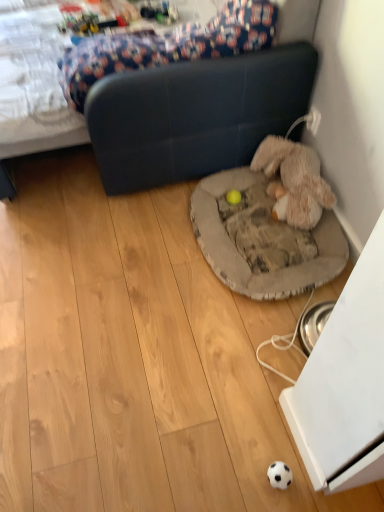
Measure the distance between point (316,200) and camera.

The depth of point (316,200) is 5.65 feet.

This screenshot has height=512, width=384. In order to click on fuzzy beige stuffed animal at lower right, which ranks as the 1th toy in right-to-left order in this screenshot , I will do `click(295, 179)`.

What is the approximate width of gray fabric dog bed at center?

gray fabric dog bed at center is 22.68 inches wide.

Where is `fuzzy beige stuffed animal at lower right, which ranks as the 1th toy in right-to-left order`? The image size is (384, 512). fuzzy beige stuffed animal at lower right, which ranks as the 1th toy in right-to-left order is located at coordinates (295, 179).

Between fuzzy beige stuffed animal at lower right, which ranks as the 1th toy in right-to-left order, and floral fabric mattress at upper left, which one appears on the left side from the viewer's perspective?

From the viewer's perspective, floral fabric mattress at upper left appears more on the left side.

Where is `toy that is the 1st object located below the floral fabric mattress at upper left (from the image's perspective)`? The height and width of the screenshot is (512, 384). toy that is the 1st object located below the floral fabric mattress at upper left (from the image's perspective) is located at coordinates (295, 179).

Does point (296, 222) come behind point (78, 73)?

Yes, point (296, 222) is behind point (78, 73).

Is fuzzy beige stuffed animal at lower right, the 2th toy from the left, positioned behind floral fabric mattress at upper left?

Yes, fuzzy beige stuffed animal at lower right, the 2th toy from the left, is behind floral fabric mattress at upper left.

Looking at this image, how many degrees apart are the facing directions of fuzzy beige stuffed animal at lower right, the 2th toy from the left, and gray fabric dog bed at center?

The facing directions of fuzzy beige stuffed animal at lower right, the 2th toy from the left, and gray fabric dog bed at center are 2.88e-05 degrees apart.

Does fuzzy beige stuffed animal at lower right, which ranks as the 1th toy in right-to-left order, appear on the left side of gray fabric dog bed at center?

No, fuzzy beige stuffed animal at lower right, which ranks as the 1th toy in right-to-left order, is not to the left of gray fabric dog bed at center.

This screenshot has height=512, width=384. I want to click on the 2nd toy positioned above the gray fabric dog bed at center (from the image's perspective), so click(x=295, y=179).

Considering the positions of objects gray fabric dog bed at center and dark blue leather studio couch at center in the image provided, who is more to the right, gray fabric dog bed at center or dark blue leather studio couch at center?

gray fabric dog bed at center.

In the image, there is a dark blue leather studio couch at center. What are the coordinates of `dog bed below it (from a real-world perspective)` in the screenshot? It's located at (262, 240).

In terms of height, does gray fabric dog bed at center look taller or shorter compared to dark blue leather studio couch at center?

Considering their sizes, gray fabric dog bed at center has less height than dark blue leather studio couch at center.

From the image's perspective, is gray fabric dog bed at center positioned above or below dark blue leather studio couch at center?

gray fabric dog bed at center is below dark blue leather studio couch at center.

Is gray fabric dog bed at center situated inside floral fabric mattress at upper left or outside?

gray fabric dog bed at center lies outside floral fabric mattress at upper left.

Is gray fabric dog bed at center in contact with floral fabric mattress at upper left?

gray fabric dog bed at center is not next to floral fabric mattress at upper left, and they're not touching.

Considering the positions of objects gray fabric dog bed at center and floral fabric mattress at upper left in the image provided, who is in front, gray fabric dog bed at center or floral fabric mattress at upper left?

floral fabric mattress at upper left is more forward.

What's the angular difference between gray fabric dog bed at center and floral fabric mattress at upper left's facing directions?

There is a 1.57-degree angle between the facing directions of gray fabric dog bed at center and floral fabric mattress at upper left.

Considering the relative sizes of yellow rubber ball at center, which ranks as the 1th toy in left-to-right order, and gray fabric dog bed at center in the image provided, is yellow rubber ball at center, which ranks as the 1th toy in left-to-right order, thinner than gray fabric dog bed at center?

Correct, the width of yellow rubber ball at center, which ranks as the 1th toy in left-to-right order, is less than that of gray fabric dog bed at center.

Can you tell me how much yellow rubber ball at center, marked as the 2th toy in a right-to-left arrangement, and gray fabric dog bed at center differ in facing direction?

yellow rubber ball at center, marked as the 2th toy in a right-to-left arrangement, and gray fabric dog bed at center are facing 0.236 degrees away from each other.

Is yellow rubber ball at center, which ranks as the 1th toy in left-to-right order, to the right of gray fabric dog bed at center from the viewer's perspective?

In fact, yellow rubber ball at center, which ranks as the 1th toy in left-to-right order, is to the left of gray fabric dog bed at center.

From a real-world perspective, which is physically above, yellow rubber ball at center, which ranks as the 1th toy in left-to-right order, or gray fabric dog bed at center?

From a 3D spatial view, gray fabric dog bed at center is above.

Which of these two, floral fabric mattress at upper left or gray fabric dog bed at center, is smaller?

Smaller between the two is gray fabric dog bed at center.

From the image's perspective, which object appears higher, floral fabric mattress at upper left or gray fabric dog bed at center?

floral fabric mattress at upper left is shown above in the image.

Considering the positions of point (101, 47) and point (267, 273), is point (101, 47) closer or farther from the camera than point (267, 273)?

Clearly, point (101, 47) is closer to the camera than point (267, 273).

Based on the photo, can you confirm if floral fabric mattress at upper left is positioned to the left of gray fabric dog bed at center?

Yes.

Could fuzzy beige stuffed animal at lower right, the 2th toy from the left, be considered to be inside gray fabric dog bed at center?

No, gray fabric dog bed at center does not contain fuzzy beige stuffed animal at lower right, the 2th toy from the left.

Find the location of a particular element. dog bed located on the left of fuzzy beige stuffed animal at lower right, which ranks as the 1th toy in right-to-left order is located at coordinates (262, 240).

From a real-world perspective, is gray fabric dog bed at center physically located above or below fuzzy beige stuffed animal at lower right, which ranks as the 1th toy in right-to-left order?

From a real-world perspective, gray fabric dog bed at center is physically below fuzzy beige stuffed animal at lower right, which ranks as the 1th toy in right-to-left order.

Based on the photo, is gray fabric dog bed at center facing towards fuzzy beige stuffed animal at lower right, which ranks as the 1th toy in right-to-left order?

No.

You are a GUI agent. You are given a task and a screenshot of the screen. Output one action in this format:
    pyautogui.click(x=<x>, y=<y>)
    Task: Click on the mattress located above the fuzzy beige stuffed animal at lower right, the 2th toy from the left (from the image's perspective)
    This screenshot has width=384, height=512.
    Given the screenshot: What is the action you would take?
    pyautogui.click(x=167, y=46)

Where is `toy to the right of gray fabric dog bed at center`? This screenshot has height=512, width=384. toy to the right of gray fabric dog bed at center is located at coordinates (295, 179).

From the image, which object appears to be farther from floral fabric mattress at upper left, yellow rubber ball at center, marked as the 2th toy in a right-to-left arrangement, or dark blue leather studio couch at center?

Among the two, yellow rubber ball at center, marked as the 2th toy in a right-to-left arrangement, is located further to floral fabric mattress at upper left.

Considering their positions, is gray fabric dog bed at center positioned further to floral fabric mattress at upper left than fuzzy beige stuffed animal at lower right, which ranks as the 1th toy in right-to-left order?

gray fabric dog bed at center.

From the image, which object appears to be nearer to yellow rubber ball at center, which ranks as the 1th toy in left-to-right order, gray fabric dog bed at center or dark blue leather studio couch at center?

gray fabric dog bed at center.

Based on the photo, estimate the real-world distances between objects in this image. Which object is closer to gray fabric dog bed at center, yellow rubber ball at center, which ranks as the 1th toy in left-to-right order, or fuzzy beige stuffed animal at lower right, the 2th toy from the left?

fuzzy beige stuffed animal at lower right, the 2th toy from the left, is closer to gray fabric dog bed at center.

Based on their spatial positions, is gray fabric dog bed at center or yellow rubber ball at center, marked as the 2th toy in a right-to-left arrangement, closer to floral fabric mattress at upper left?

gray fabric dog bed at center.

When comparing their distances from fuzzy beige stuffed animal at lower right, the 2th toy from the left, does floral fabric mattress at upper left or yellow rubber ball at center, which ranks as the 1th toy in left-to-right order, seem closer?

yellow rubber ball at center, which ranks as the 1th toy in left-to-right order, is closer to fuzzy beige stuffed animal at lower right, the 2th toy from the left.

Estimate the real-world distances between objects in this image. Which object is closer to yellow rubber ball at center, marked as the 2th toy in a right-to-left arrangement, gray fabric dog bed at center or floral fabric mattress at upper left?

Based on the image, gray fabric dog bed at center appears to be nearer to yellow rubber ball at center, marked as the 2th toy in a right-to-left arrangement.

Which object lies further to the anchor point floral fabric mattress at upper left, fuzzy beige stuffed animal at lower right, the 2th toy from the left, or dark blue leather studio couch at center?

fuzzy beige stuffed animal at lower right, the 2th toy from the left, lies further to floral fabric mattress at upper left than the other object.

The width and height of the screenshot is (384, 512). Identify the location of toy between gray fabric dog bed at center and yellow rubber ball at center, which ranks as the 1th toy in left-to-right order, from front to back. (295, 179).

I want to click on mattress between dark blue leather studio couch at center and yellow rubber ball at center, marked as the 2th toy in a right-to-left arrangement, in the vertical direction, so click(167, 46).

Identify the location of toy between floral fabric mattress at upper left and yellow rubber ball at center, which ranks as the 1th toy in left-to-right order, in the up-down direction. (295, 179).

Find the location of a particular element. mattress between dark blue leather studio couch at center and fuzzy beige stuffed animal at lower right, the 2th toy from the left, in the vertical direction is located at coordinates (167, 46).